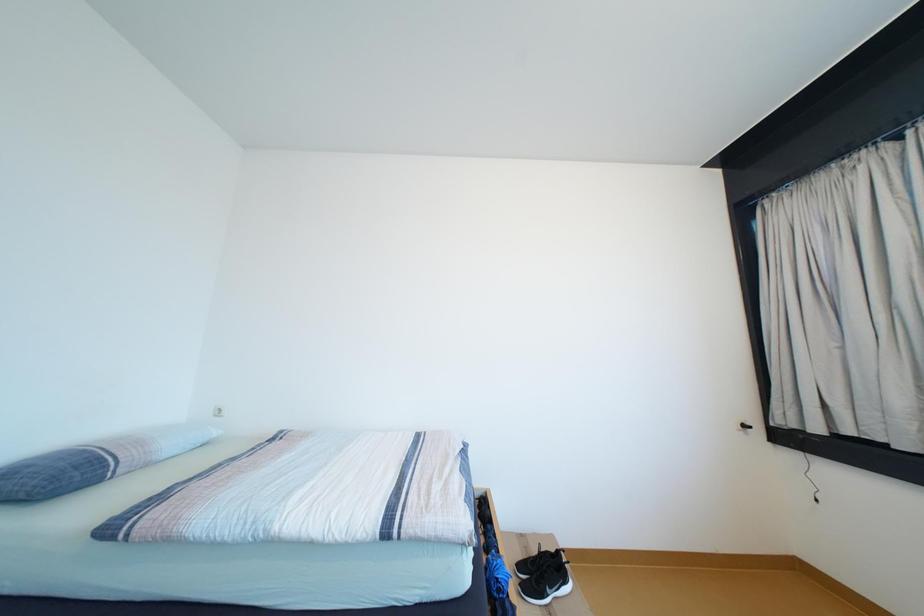
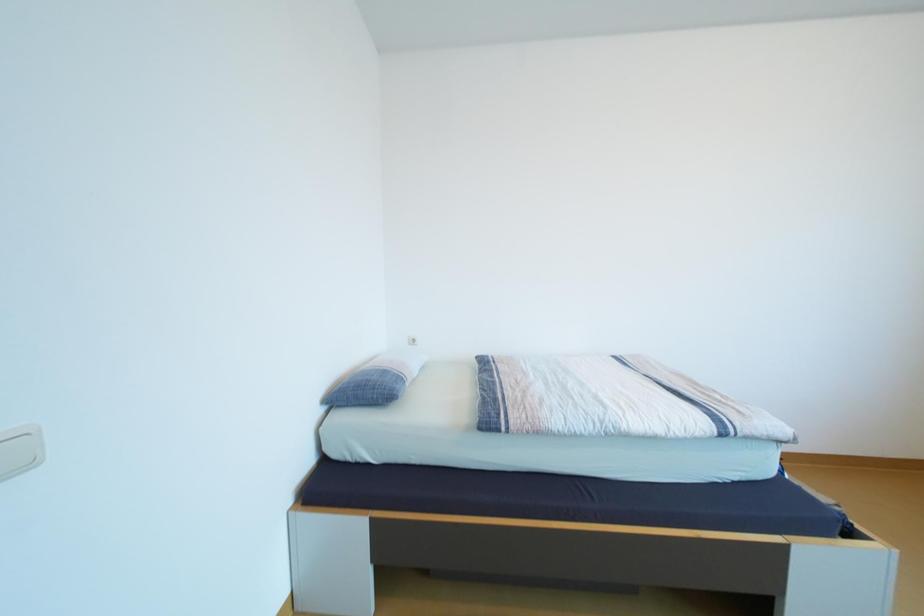
Question: Which direction would the cameraman need to move to produce the second image? Reply with the corresponding letter.

Choices:
 (A) Left
 (B) Right
 (C) Forward
 (D) Backward

Answer: (A)